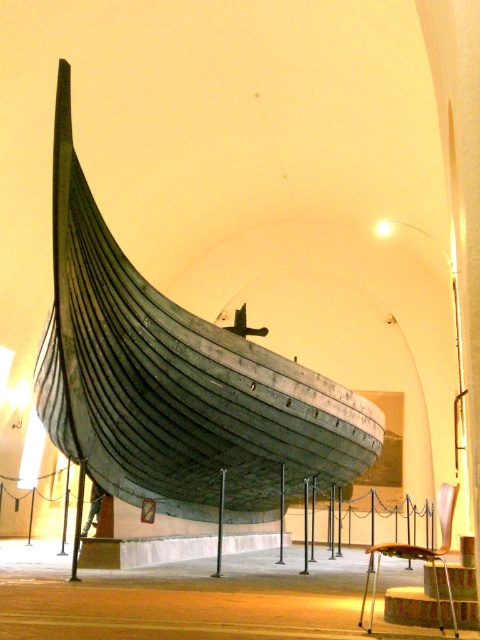
You are a tour guide explaining the Viking ship exhibit. A visitor asks, pointing to the coordinates point (x=176, y=381), what is located at that point on the ship? Please identify the object at that coordinate.

The point (x=176, y=381) corresponds to the wooden boat at center, which is the Viking ship itself.

You are a museum visitor standing in front of the wooden boat at center. You notice a wooden textured stool at lower right nearby. If you want to place a small souvenir on the widest object between the two, which one should you choose?

The wooden textured stool at lower right is wider than the wooden boat at center, so you should place the souvenir on the wooden textured stool at lower right.